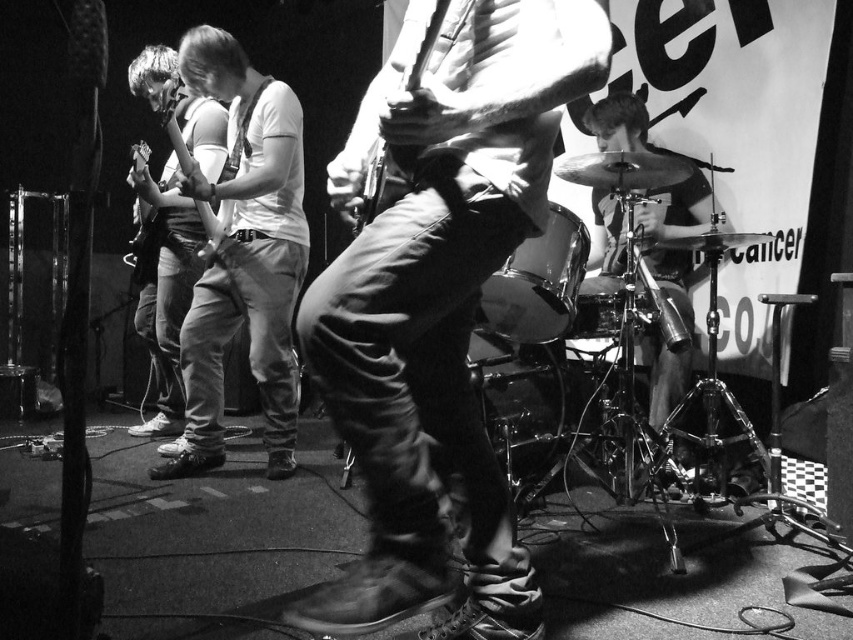
You are a photographer trying to capture the guitarist in the center. Based on the scene, where should you focus your camera to ensure the leather boots at center and the matte white guitar at center are both in frame?

You should focus your camera on the area where the leather boots at center are located below the matte white guitar at center, ensuring both are visible in the frame.

You are a photographer holding a camera at the back of the stage. You want to capture a close shot of the leather boots at center. Can you move closer to the boots without exceeding the 1.5 meters safety distance rule? Please explain.

The distance between the leather boots at center and the camera is 1.45 meters, which is within the 1.5 meters safety distance. Therefore, you can move closer to the boots while adhering to the safety rule.

In the scene shown: Based on the scene description, which item is positioned lower in the image, the leather boots at center or the denim pants at center?

The leather boots at center are positioned below the denim pants at center.